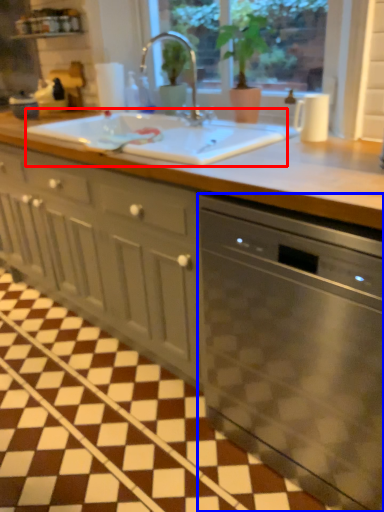
Question: Which object appears closest to the camera in this image, sink (highlighted by a red box) or home appliance (highlighted by a blue box)?

Choices:
 (A) sink
 (B) home appliance

Answer: (B)